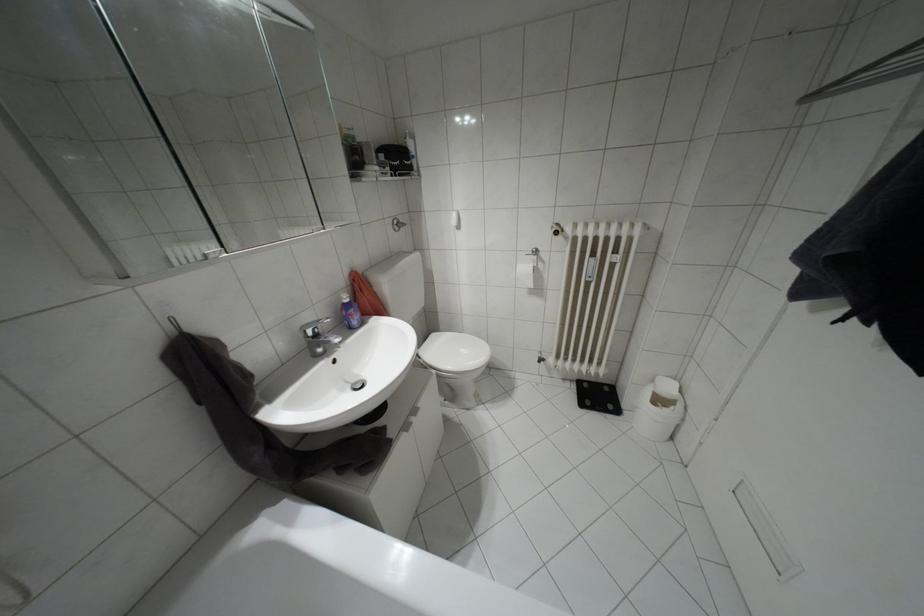
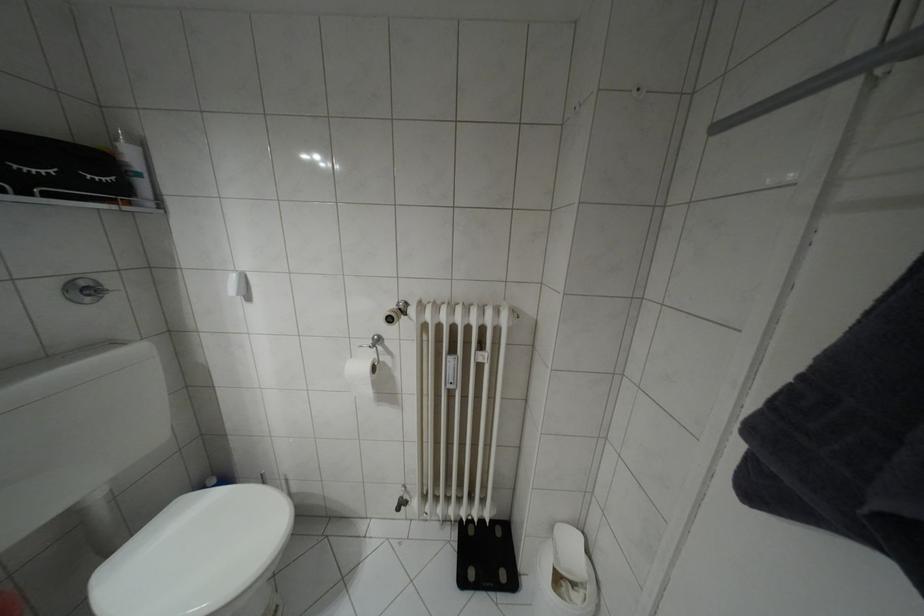
The point at (399,175) is marked in the first image. Where is the corresponding point in the second image?

(49, 195)